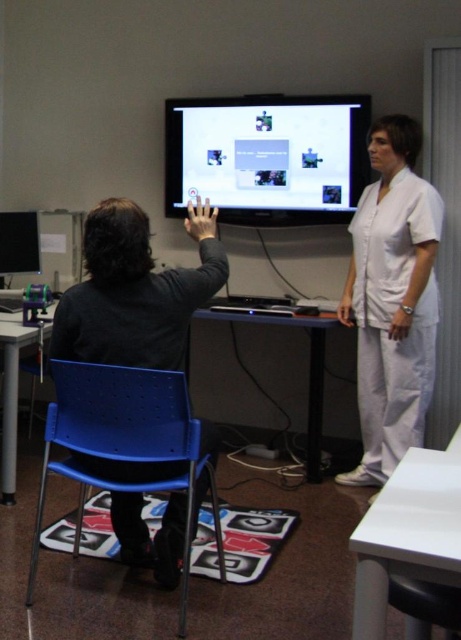
You are a physical therapist working with a patient who needs to perform exercises while seated. You have a blue plastic chair at lower left and a blue plastic table at center. The patient needs to reach a therapy tool placed on the table. Can the patient comfortably reach the tool from the chair without moving their chair?

The blue plastic chair at lower left and blue plastic table at center are 4.27 feet apart. Since the distance between them is about 4.27 feet, the patient may find it difficult to comfortably reach the tool placed on the table from the chair without moving closer.

You are a physical therapist working with a patient who needs to improve their arm mobility. The patient is seated on the blue plastic chair at lower left. You want to place a small sensor on their right hand to track movement during the game. The sensor must be placed exactly at point (124, 444) on the screen. Can you confirm if this point is on the patient or somewhere else?

The point (124, 444) corresponds to the blue plastic chair at lower left, so the sensor should be placed on the blue plastic chair at lower left, not on the patient.

You are a physical therapist working with a patient in a rehabilitation session. You have a black matte chair at left and a matte black monitor at center in front of you. To ensure proper alignment for the patient to interact with the monitor using motion controls, which object should be placed to the left of the other?

The black matte chair at left should be positioned to the left of the matte black monitor at center to ensure proper alignment for the patient to interact with the monitor using motion controls.